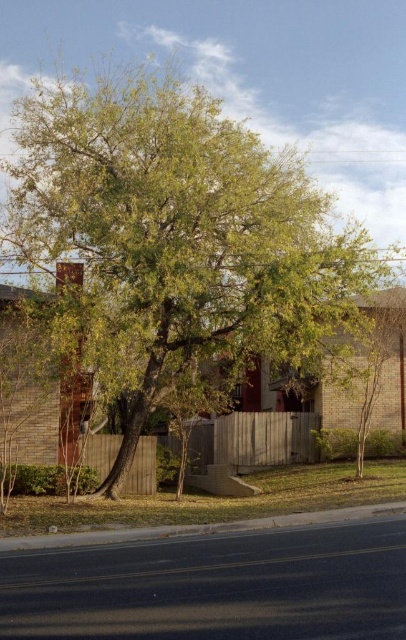
Question: Does green leafy tree at center come behind wooden fence at center?

Choices:
 (A) no
 (B) yes

Answer: (A)

Question: Considering the relative positions of green leafy tree at center and wooden fence at center in the image provided, where is green leafy tree at center located with respect to wooden fence at center?

Choices:
 (A) below
 (B) above

Answer: (B)

Question: Which object appears closest to the camera in this image?

Choices:
 (A) green leafy tree at center
 (B) wooden fence at center

Answer: (A)

Question: Is green leafy tree at center positioned in front of wooden fence at center?

Choices:
 (A) yes
 (B) no

Answer: (A)

Question: Among these points, which one is nearest to the camera?

Choices:
 (A) (144, 476)
 (B) (118, 240)

Answer: (B)